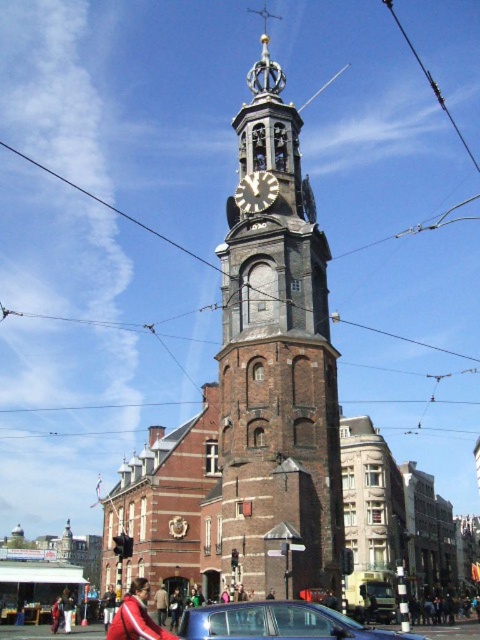
Does point (265, 269) come behind point (247, 195)?

No, (265, 269) is in front of (247, 195).

Is point (251, 243) positioned before point (261, 176)?

That is True.

Image resolution: width=480 pixels, height=640 pixels. Identify the location of brick tower at center. (x=276, y=369).

Who is more distant from viewer, (249, 204) or (420, 61)?

The point (420, 61) is more distant.

Who is positioned more to the right, silver metallic clock at upper center or metallic wire at upper right?

metallic wire at upper right is more to the right.

The image size is (480, 640). What do you see at coordinates (255, 192) in the screenshot?
I see `silver metallic clock at upper center` at bounding box center [255, 192].

You are a GUI agent. You are given a task and a screenshot of the screen. Output one action in this format:
    pyautogui.click(x=<x>, y=<y>)
    Task: Click on the silver metallic clock at upper center
    
    Given the screenshot: What is the action you would take?
    pyautogui.click(x=255, y=192)

Who is higher up, brick tower at center or metallic wire at upper right?

Positioned higher is metallic wire at upper right.

Between brick tower at center and metallic wire at upper right, which one appears on the right side from the viewer's perspective?

From the viewer's perspective, metallic wire at upper right appears more on the right side.

Is point (286, 134) closer to viewer compared to point (440, 102)?

That is True.

Locate an element on the screen. brick tower at center is located at coordinates (276, 369).